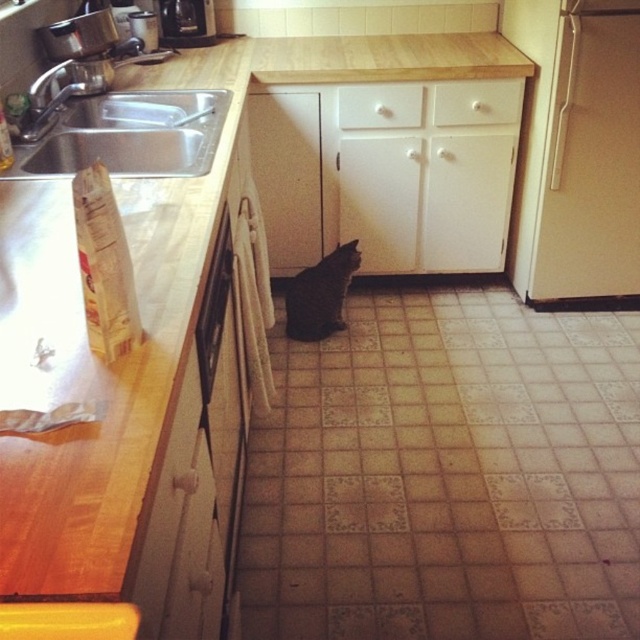
You are trying to decide whether to place a rectangular box that is 12 inches wide on the white matte drawer at upper center or the brushed metal coffee maker at upper left. Based on their widths, which surface can accommodate the box?

The white matte drawer at upper center might be wider than the brushed metal coffee maker at upper left, so it is more likely to accommodate the 12 inch wide box.

You are trying to decide whether to place a tall plant next to the white matte refrigerator at right or the brushed metal coffee maker at upper left. Based on their heights, which object can accommodate a taller plant beside it?

The white matte refrigerator at right has a greater height compared to the brushed metal coffee maker at upper left, so it can accommodate a taller plant beside it.